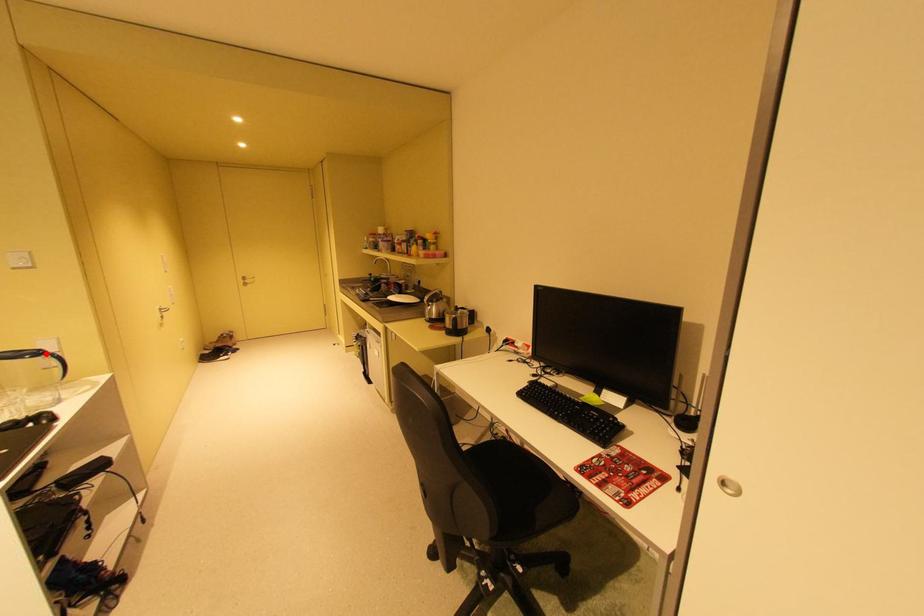
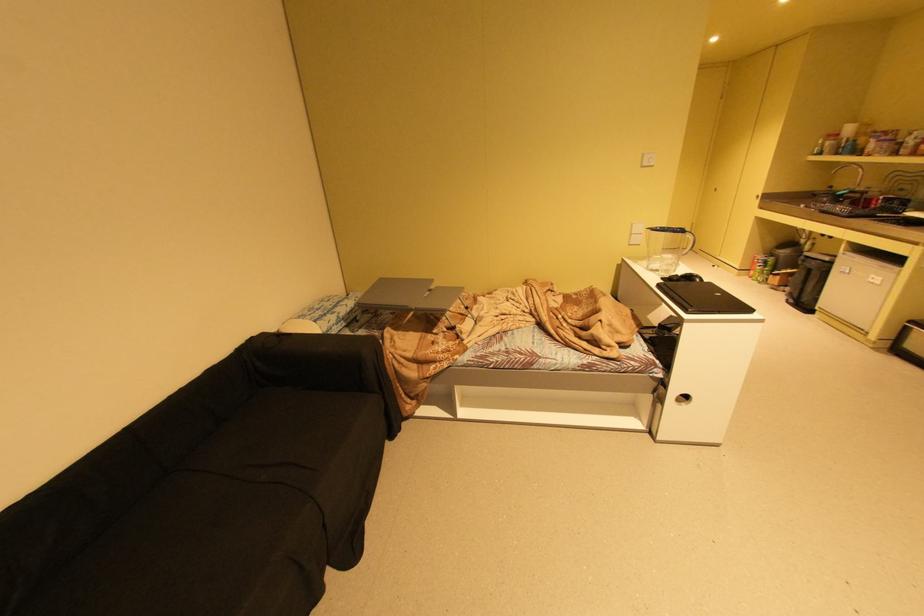
Locate, in the second image, the point that corresponds to the highlighted location in the first image.

(688, 231)